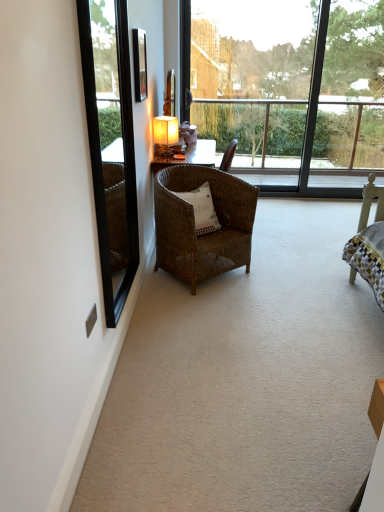
Question: Considering the relative positions of woven brown chair at center and matte black picture frame at upper center in the image provided, is woven brown chair at center to the left of matte black picture frame at upper center from the viewer's perspective?

Choices:
 (A) yes
 (B) no

Answer: (B)

Question: Could you tell me if woven brown chair at center is facing matte black picture frame at upper center?

Choices:
 (A) yes
 (B) no

Answer: (B)

Question: Does woven brown chair at center lie in front of matte black picture frame at upper center?

Choices:
 (A) no
 (B) yes

Answer: (A)

Question: Can you confirm if woven brown chair at center is bigger than matte black picture frame at upper center?

Choices:
 (A) no
 (B) yes

Answer: (B)

Question: Considering the relative sizes of woven brown chair at center and matte black picture frame at upper center in the image provided, is woven brown chair at center smaller than matte black picture frame at upper center?

Choices:
 (A) yes
 (B) no

Answer: (B)

Question: Is metallic silver power outlet at lower left in front of or behind matte yellow lampshade at center in the image?

Choices:
 (A) behind
 (B) front

Answer: (B)

Question: In terms of width, does metallic silver power outlet at lower left look wider or thinner when compared to matte yellow lampshade at center?

Choices:
 (A) wide
 (B) thin

Answer: (B)

Question: Is point (89, 327) positioned closer to the camera than point (175, 148)?

Choices:
 (A) closer
 (B) farther

Answer: (A)

Question: Considering the positions of metallic silver power outlet at lower left and matte yellow lampshade at center in the image, is metallic silver power outlet at lower left taller or shorter than matte yellow lampshade at center?

Choices:
 (A) short
 (B) tall

Answer: (A)

Question: From a real-world perspective, is black glass mirror at left physically located above or below metallic silver power outlet at lower left?

Choices:
 (A) above
 (B) below

Answer: (A)

Question: Is point (129, 102) closer or farther from the camera than point (89, 324)?

Choices:
 (A) farther
 (B) closer

Answer: (A)

Question: Do you think black glass mirror at left is within metallic silver power outlet at lower left, or outside of it?

Choices:
 (A) inside
 (B) outside

Answer: (B)

Question: Considering the positions of black glass mirror at left and metallic silver power outlet at lower left in the image, is black glass mirror at left taller or shorter than metallic silver power outlet at lower left?

Choices:
 (A) tall
 (B) short

Answer: (A)

Question: Considering the relative positions of woven brown chair at center and matte yellow lampshade at center in the image provided, is woven brown chair at center to the left or to the right of matte yellow lampshade at center?

Choices:
 (A) left
 (B) right

Answer: (B)

Question: Is point (246, 222) positioned closer to the camera than point (173, 131)?

Choices:
 (A) closer
 (B) farther

Answer: (A)